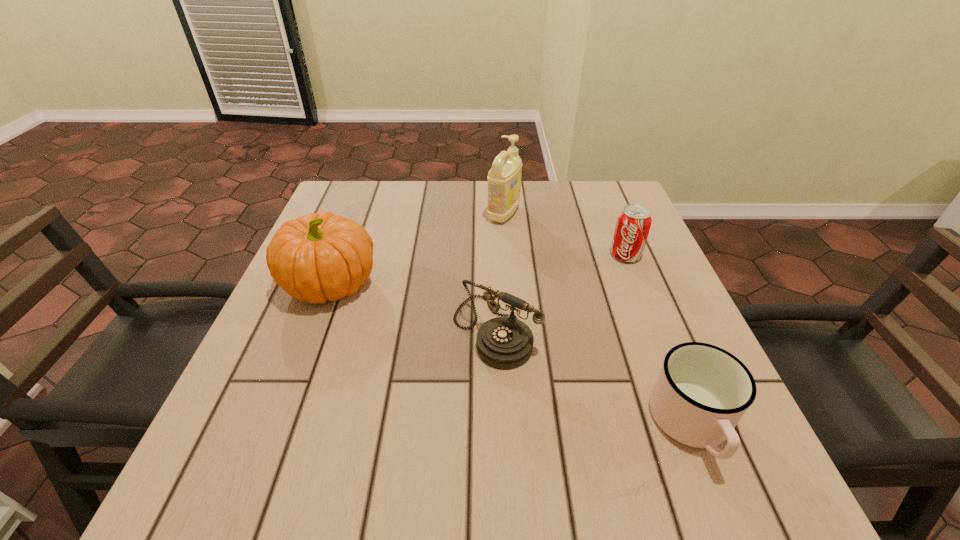
Locate an element on the screen. free spot that satisfies the following two spatial constraints: 1. on the back side of the detergent; 2. on the right side of the telephone is located at coordinates (492, 214).

Find the location of `vacant area in the image that satisfies the following two spatial constraints: 1. on the surface of the telephone; 2. on the right side of the leftmost object`. vacant area in the image that satisfies the following two spatial constraints: 1. on the surface of the telephone; 2. on the right side of the leftmost object is located at coordinates (315, 330).

Locate an element on the screen. vacant area in the image that satisfies the following two spatial constraints: 1. on the front side of the soda; 2. on the surface of the pumpkin is located at coordinates (636, 284).

Image resolution: width=960 pixels, height=540 pixels. What are the coordinates of `free space that satisfies the following two spatial constraints: 1. on the surface of the telephone; 2. on the left side of the pumpkin` in the screenshot? It's located at (315, 330).